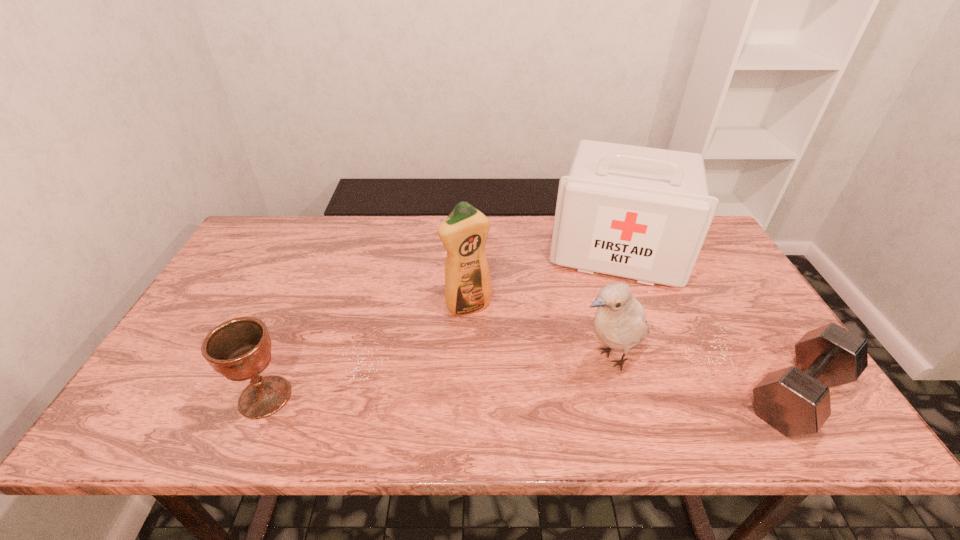
Find the location of a particular element. vacant space that is in between the shortest object and the second object from left to right is located at coordinates (634, 350).

Identify the location of vacant space that is in between the shortest object and the third shortest object. (706, 375).

This screenshot has height=540, width=960. In order to click on vacant space that's between the fourth tallest object and the farthest object in this screenshot , I will do `click(441, 323)`.

You are a GUI agent. You are given a task and a screenshot of the screen. Output one action in this format:
    pyautogui.click(x=<x>, y=<y>)
    Task: Click on the free spot between the first-aid kit and the detergent
    
    Given the screenshot: What is the action you would take?
    pyautogui.click(x=542, y=278)

Identify the location of blank region between the shortest object and the first-aid kit. (708, 322).

This screenshot has width=960, height=540. I want to click on free space between the chalice and the first-aid kit, so click(x=441, y=323).

Where is `vacant region between the fourth tallest object and the fourth nearest object`? This screenshot has width=960, height=540. vacant region between the fourth tallest object and the fourth nearest object is located at coordinates (367, 352).

The width and height of the screenshot is (960, 540). Find the location of `free point between the farthest object and the second shortest object`. free point between the farthest object and the second shortest object is located at coordinates point(441,323).

The image size is (960, 540). I want to click on free spot between the fourth tallest object and the second farthest object, so click(367, 352).

Where is `object that is the second closest one to the dumbbell`? object that is the second closest one to the dumbbell is located at coordinates (642, 213).